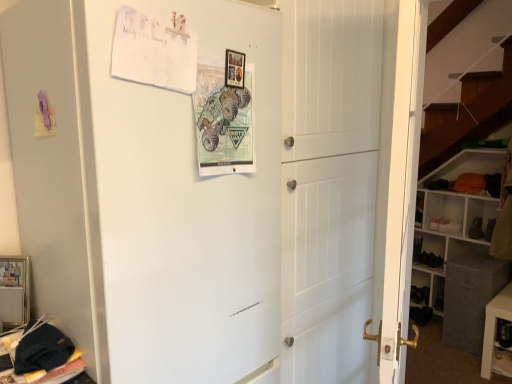
Question: In which direction should I rotate to look at matte paper postcard at center, placed as the 2th postcard when sorted from left to right?

Choices:
 (A) right
 (B) left

Answer: (B)

Question: From the image's perspective, is black leather shoe at lower right, placed as the second shoe when sorted from left to right, located above matte paper postcard at center, which ranks as the 1th postcard in right-to-left order?

Choices:
 (A) no
 (B) yes

Answer: (A)

Question: Is black leather shoe at lower right, placed as the second shoe when sorted from left to right, facing towards matte paper postcard at center, which ranks as the 1th postcard in right-to-left order?

Choices:
 (A) yes
 (B) no

Answer: (A)

Question: Is black leather shoe at lower right, placed as the second shoe when sorted from left to right, next to matte paper postcard at center, placed as the 2th postcard when sorted from left to right, and touching it?

Choices:
 (A) yes
 (B) no

Answer: (B)

Question: Does black leather shoe at lower right, which ranks as the first shoe in right-to-left order, have a lesser width compared to matte paper postcard at center, placed as the 2th postcard when sorted from left to right?

Choices:
 (A) yes
 (B) no

Answer: (B)

Question: Can you confirm if black leather shoe at lower right, placed as the second shoe when sorted from left to right, is positioned to the right of matte paper postcard at center, placed as the 2th postcard when sorted from left to right?

Choices:
 (A) no
 (B) yes

Answer: (B)

Question: Is black leather shoe at lower right, placed as the second shoe when sorted from left to right, shorter than matte paper postcard at center, which ranks as the 1th postcard in right-to-left order?

Choices:
 (A) no
 (B) yes

Answer: (B)

Question: Can you confirm if white paper postcard at upper left, which appears as the 1th postcard when viewed from the left, is thinner than white matte refrigerator at upper left?

Choices:
 (A) yes
 (B) no

Answer: (A)

Question: Does white paper postcard at upper left, which appears as the 1th postcard when viewed from the left, have a greater height compared to white matte refrigerator at upper left?

Choices:
 (A) yes
 (B) no

Answer: (B)

Question: Is white paper postcard at upper left, which is the second postcard in right-to-left order, turned away from white matte refrigerator at upper left?

Choices:
 (A) no
 (B) yes

Answer: (B)

Question: Does white paper postcard at upper left, which is the second postcard in right-to-left order, lie in front of white matte refrigerator at upper left?

Choices:
 (A) no
 (B) yes

Answer: (A)

Question: From a real-world perspective, does white paper postcard at upper left, which appears as the 1th postcard when viewed from the left, sit lower than white matte refrigerator at upper left?

Choices:
 (A) no
 (B) yes

Answer: (A)

Question: Considering the relative sizes of white paper postcard at upper left, which is the second postcard in right-to-left order, and white matte refrigerator at upper left in the image provided, is white paper postcard at upper left, which is the second postcard in right-to-left order, wider than white matte refrigerator at upper left?

Choices:
 (A) yes
 (B) no

Answer: (B)

Question: From a real-world perspective, is black leather shoe at lower right, placed as the second shoe when sorted from left to right, positioned over white matte refrigerator at upper left based on gravity?

Choices:
 (A) yes
 (B) no

Answer: (B)